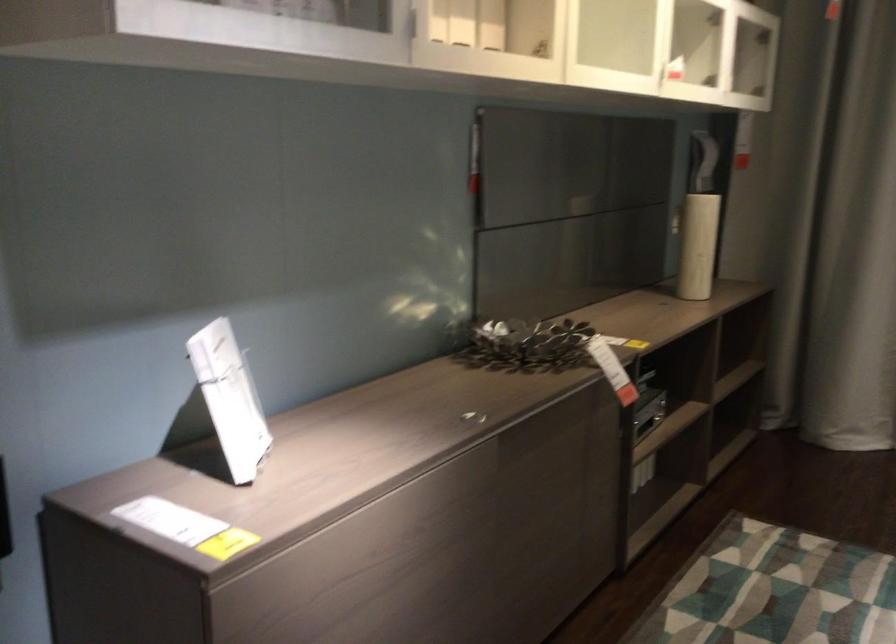
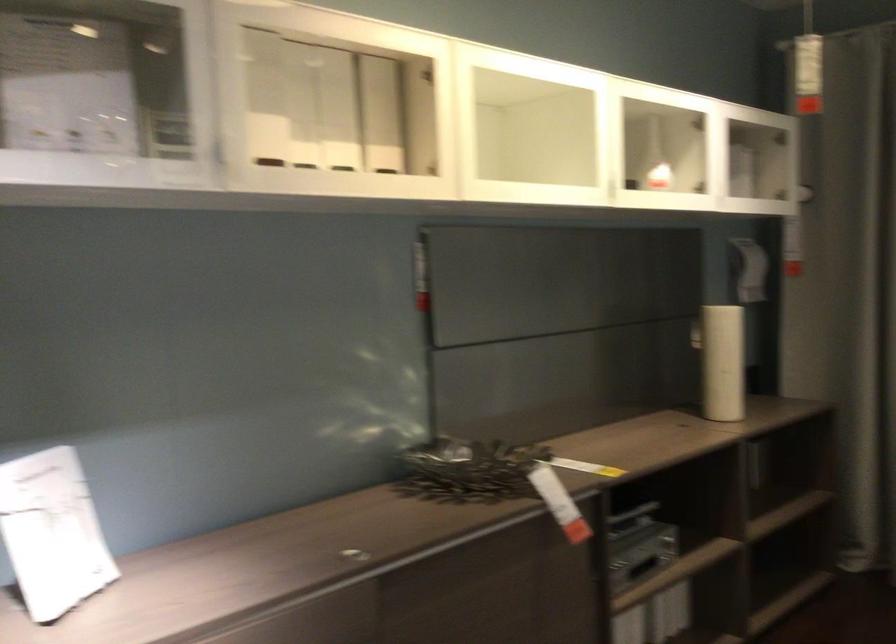
Question: The first image is from the beginning of the video and the second image is from the end. How did the camera likely rotate when shooting the video?

Choices:
 (A) Left
 (B) Right
 (C) Up
 (D) Down

Answer: (A)